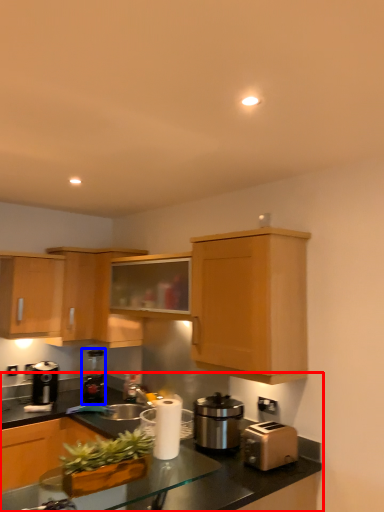
Question: Which of the following is the closest to the observer, countertop (highlighted by a red box) or coffee machine (highlighted by a blue box)?

Choices:
 (A) countertop
 (B) coffee machine

Answer: (A)